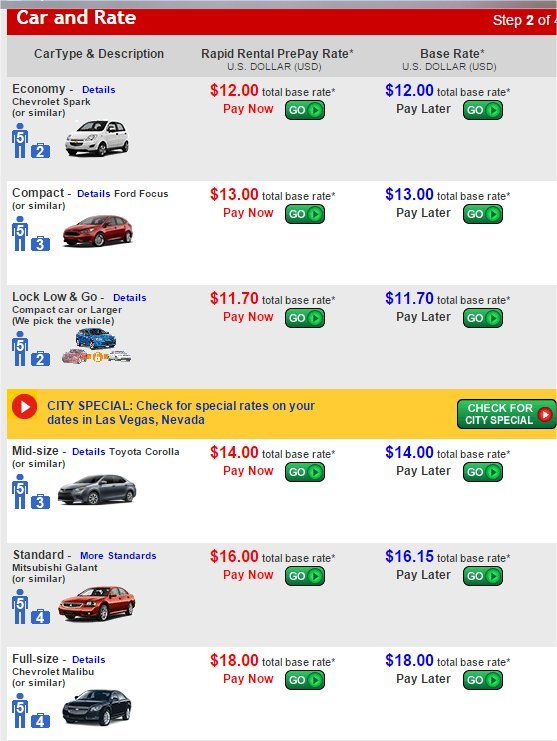
You are a GUI agent. You are given a task and a screenshot of the screen. Output one action in this format:
    pyautogui.click(x=<x>, y=<y>)
    Task: Click on the yellow "city special" bar
    Image resolution: width=557 pixels, height=741 pixels.
    Given the screenshot: What is the action you would take?
    pyautogui.click(x=364, y=418)